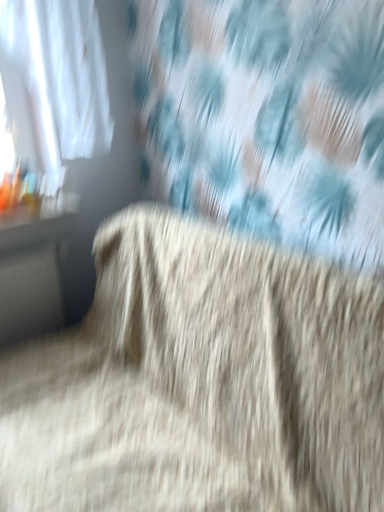
Identify the location of fuzzy beige carpet at center. This screenshot has height=512, width=384. (201, 382).

Describe the element at coordinates (201, 382) in the screenshot. I see `fuzzy beige carpet at center` at that location.

Measure the distance between matte black table at left and camera.

matte black table at left and camera are 5.55 feet apart.

I want to click on matte black table at left, so click(33, 268).

Image resolution: width=384 pixels, height=512 pixels. What do you see at coordinates (33, 268) in the screenshot?
I see `matte black table at left` at bounding box center [33, 268].

At what (x,y) coordinates should I click in order to perform the action: click on fuzzy beige carpet at center. Please return your answer as a coordinate pair (x, y). The height and width of the screenshot is (512, 384). Looking at the image, I should click on (201, 382).

Is matte black table at left at the left side of fuzzy beige carpet at center?

Yes.

Based on the photo, is matte black table at left positioned in front of fuzzy beige carpet at center?

No, matte black table at left is behind fuzzy beige carpet at center.

Considering the points (45, 270) and (219, 463), which point is in front, point (45, 270) or point (219, 463)?

The point (219, 463) is in front.

From the image's perspective, which is above, matte black table at left or fuzzy beige carpet at center?

matte black table at left appears higher in the image.

From a real-world perspective, which object rests below the other?

fuzzy beige carpet at center.

Which of these two, matte black table at left or fuzzy beige carpet at center, is wider?

fuzzy beige carpet at center.

Is matte black table at left taller or shorter than fuzzy beige carpet at center?

In the image, matte black table at left appears to be shorter than fuzzy beige carpet at center.

Between matte black table at left and fuzzy beige carpet at center, which one has smaller size?

matte black table at left.

Can we say matte black table at left lies outside fuzzy beige carpet at center?

Indeed, matte black table at left is completely outside fuzzy beige carpet at center.

Is matte black table at left beside fuzzy beige carpet at center?

No, matte black table at left is not in contact with fuzzy beige carpet at center.

Could you tell me if matte black table at left is facing fuzzy beige carpet at center?

Yes, matte black table at left is oriented towards fuzzy beige carpet at center.

From the picture: How many degrees apart are the facing directions of matte black table at left and fuzzy beige carpet at center?

There is a 90-degree angle between the facing directions of matte black table at left and fuzzy beige carpet at center.

You are a GUI agent. You are given a task and a screenshot of the screen. Output one action in this format:
    pyautogui.click(x=<x>, y=<y>)
    Task: Click on the furniture below the matte black table at left (from the image's perspective)
    This screenshot has height=512, width=384.
    Given the screenshot: What is the action you would take?
    pyautogui.click(x=201, y=382)

Would you say fuzzy beige carpet at center is to the left or to the right of matte black table at left in the picture?

Based on their positions, fuzzy beige carpet at center is located to the right of matte black table at left.

Considering the relative positions of fuzzy beige carpet at center and matte black table at left in the image provided, is fuzzy beige carpet at center in front of matte black table at left?

Yes, it is in front of matte black table at left.

Does point (90, 480) appear closer or farther from the camera than point (56, 264)?

Point (90, 480) is positioned closer to the camera compared to point (56, 264).

From the picture: From the image's perspective, is fuzzy beige carpet at center on matte black table at left?

No, from the image's perspective, fuzzy beige carpet at center is not above matte black table at left.

From a real-world perspective, is fuzzy beige carpet at center physically below matte black table at left?

Yes, from a real-world perspective, fuzzy beige carpet at center is below matte black table at left.

Does fuzzy beige carpet at center have a greater width compared to matte black table at left?

Correct, the width of fuzzy beige carpet at center exceeds that of matte black table at left.

Between fuzzy beige carpet at center and matte black table at left, which one has more height?

With more height is fuzzy beige carpet at center.

Is fuzzy beige carpet at center bigger than matte black table at left?

Correct, fuzzy beige carpet at center is larger in size than matte black table at left.

In the scene shown: Is matte black table at left located within fuzzy beige carpet at center?

No.

Is fuzzy beige carpet at center touching matte black table at left?

No, fuzzy beige carpet at center is not in contact with matte black table at left.

Is matte black table at left at the back of fuzzy beige carpet at center?

No, matte black table at left is not at the back of fuzzy beige carpet at center.

Find the location of a particular element. table positioned vertically above the fuzzy beige carpet at center (from a real-world perspective) is located at coordinates (33, 268).

This screenshot has width=384, height=512. In the image, there is a fuzzy beige carpet at center. In order to click on table above it (from the image's perspective) in this screenshot , I will do `click(33, 268)`.

Find the location of a particular element. The width and height of the screenshot is (384, 512). table behind the fuzzy beige carpet at center is located at coordinates (33, 268).